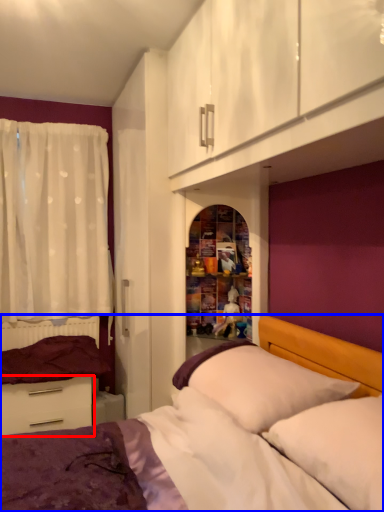
Question: Among these objects, which one is nearest to the camera, drawer (highlighted by a red box) or bed (highlighted by a blue box)?

Choices:
 (A) drawer
 (B) bed

Answer: (B)